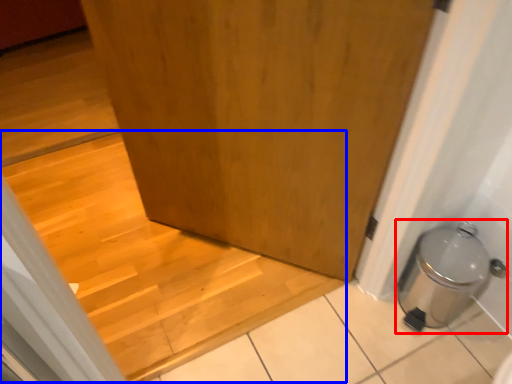
Question: Which point is further to the camera, water heater (highlighted by a red box) or stairwell (highlighted by a blue box)?

Choices:
 (A) water heater
 (B) stairwell

Answer: (B)